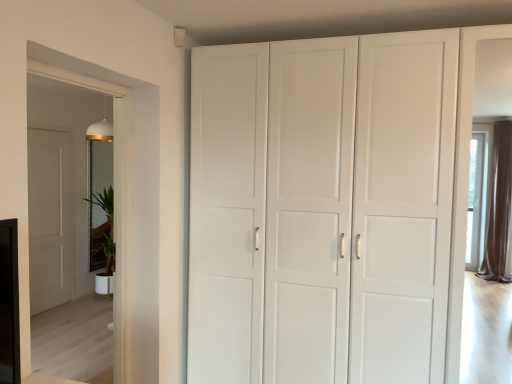
Question: From the image's perspective, is transparent glass door at left over white matte cabinet at center?

Choices:
 (A) no
 (B) yes

Answer: (B)

Question: Considering the relative positions of transparent glass door at left and white matte cabinet at center in the image provided, is transparent glass door at left to the left of white matte cabinet at center from the viewer's perspective?

Choices:
 (A) no
 (B) yes

Answer: (B)

Question: Can we say transparent glass door at left lies outside white matte cabinet at center?

Choices:
 (A) yes
 (B) no

Answer: (A)

Question: Is transparent glass door at left behind white matte cabinet at center?

Choices:
 (A) yes
 (B) no

Answer: (B)

Question: Is transparent glass door at left at the right side of white matte cabinet at center?

Choices:
 (A) yes
 (B) no

Answer: (B)

Question: Can you confirm if transparent glass door at left is wider than white matte cabinet at center?

Choices:
 (A) yes
 (B) no

Answer: (B)

Question: From a real-world perspective, does transparent glass door at left stand above white glossy plant at left?

Choices:
 (A) no
 (B) yes

Answer: (B)

Question: Is transparent glass door at left positioned with its back to white glossy plant at left?

Choices:
 (A) yes
 (B) no

Answer: (B)

Question: Can you confirm if transparent glass door at left is shorter than white glossy plant at left?

Choices:
 (A) no
 (B) yes

Answer: (A)

Question: Does transparent glass door at left lie behind white glossy plant at left?

Choices:
 (A) no
 (B) yes

Answer: (A)

Question: Can you confirm if transparent glass door at left is positioned to the right of white glossy plant at left?

Choices:
 (A) no
 (B) yes

Answer: (B)

Question: From the image's perspective, would you say transparent glass door at left is shown under white glossy plant at left?

Choices:
 (A) yes
 (B) no

Answer: (B)

Question: Does white glossy plant at left appear on the left side of white matte cabinet at center?

Choices:
 (A) yes
 (B) no

Answer: (A)